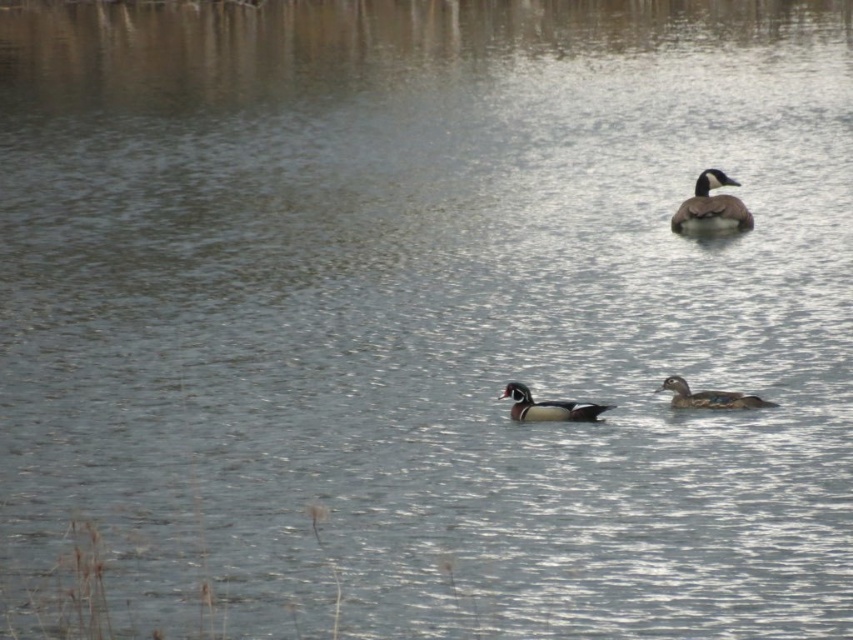
Who is more distant from viewer, (752, 227) or (543, 404)?

The point (752, 227) is behind.

Is brown speckled duck at upper right shorter than shiny brown duck at center?

No.

Between point (680, 221) and point (560, 403), which one is positioned in front?

Point (560, 403) is in front.

Find the location of a particular element. Image resolution: width=853 pixels, height=640 pixels. brown speckled duck at upper right is located at coordinates (711, 208).

Is point (718, 225) more distant than point (701, 401)?

Yes.

Does brown speckled duck at upper right come in front of multicolored glossy wood duck at center?

No, it is not.

Between point (724, 212) and point (685, 387), which one is positioned behind?

Point (724, 212)

Locate an element on the screen. brown speckled duck at upper right is located at coordinates (711, 208).

Consider the image. Does shiny brown duck at center have a larger size compared to multicolored glossy wood duck at center?

No, shiny brown duck at center is not bigger than multicolored glossy wood duck at center.

Is point (582, 420) positioned in front of point (683, 404)?

No, (582, 420) is behind (683, 404).

This screenshot has height=640, width=853. Identify the location of shiny brown duck at center. (548, 406).